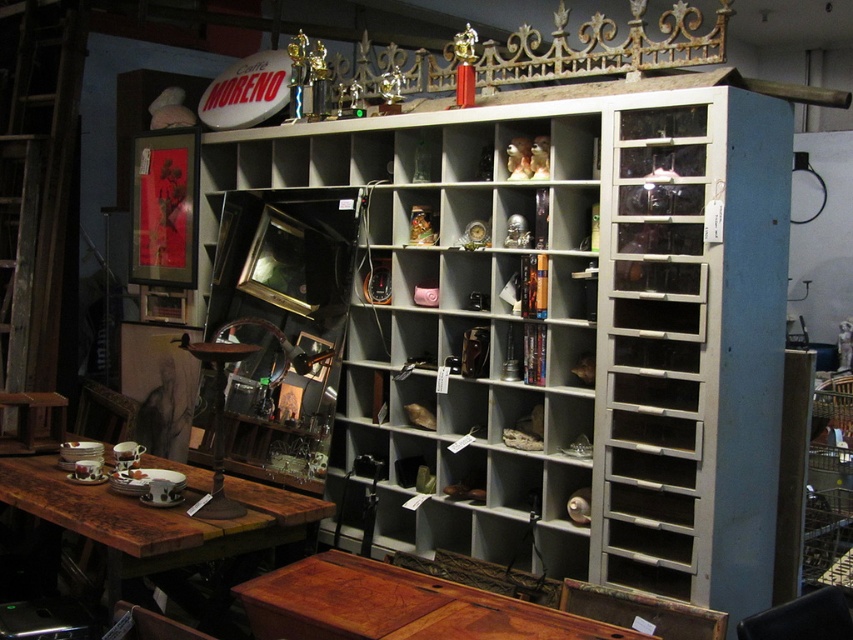
You are standing in the storage area and want to reach the point at coordinates point (728,538). To do this, you must first navigate around an obstacle located at point (221,525). Can you determine if the point you want to reach is behind or in front of the obstacle?

Point (728,538) is behind point (221,525), so you need to go around the obstacle at point (221,525) to reach it.

You are organizing a small event and need to place a 1.2 meter long banner between the white painted wood bookshelf at center and the wooden polished table at lower center. Can the space between them accommodate the banner horizontally?

The white painted wood bookshelf at center is bigger than the wooden polished table at lower center, but the exact distance between them isn not provided. Without knowing the distance, it is impossible to determine if the banner will fit.